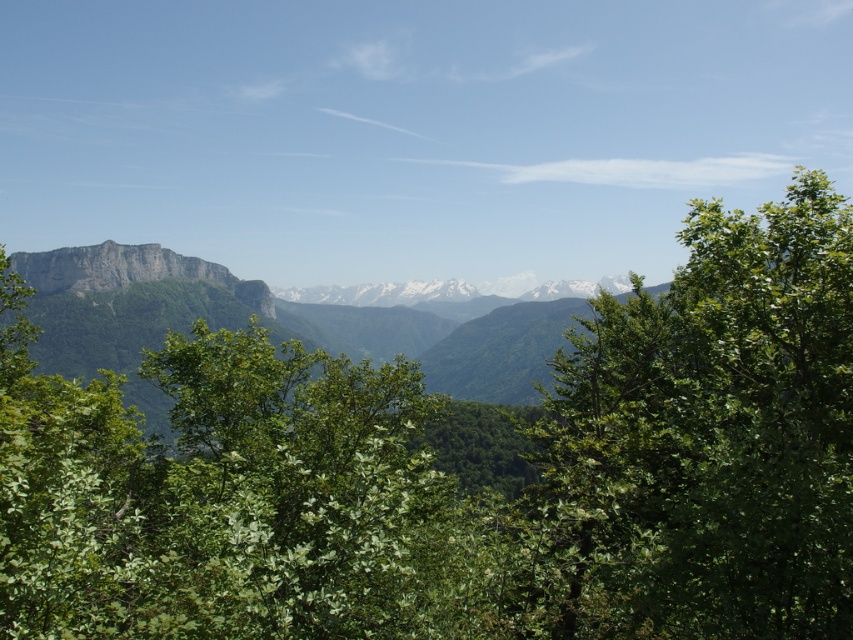
Does green leafy tree at right appear under rocky cliff at center?

Yes.

Who is positioned more to the left, green leafy tree at right or rocky cliff at center?

From the viewer's perspective, rocky cliff at center appears more on the left side.

I want to click on green leafy tree at right, so click(x=708, y=436).

Image resolution: width=853 pixels, height=640 pixels. What are the coordinates of `green leafy tree at right` in the screenshot? It's located at (708, 436).

Which is below, green leafy tree at center or green leafy tree at right?

green leafy tree at center is below.

Is green leafy tree at center wider than green leafy tree at right?

Yes.

Is point (416, 540) positioned before point (697, 554)?

No, (416, 540) is behind (697, 554).

In order to click on green leafy tree at center in this screenshot , I will do `click(451, 484)`.

Between point (30, 512) and point (65, 275), which one is positioned in front?

Point (30, 512) is more forward.

Describe the element at coordinates (451, 484) in the screenshot. The height and width of the screenshot is (640, 853). I see `green leafy tree at center` at that location.

You are a GUI agent. You are given a task and a screenshot of the screen. Output one action in this format:
    pyautogui.click(x=<x>, y=<y>)
    Task: Click on the green leafy tree at center
    
    Given the screenshot: What is the action you would take?
    pyautogui.click(x=451, y=484)

The width and height of the screenshot is (853, 640). Find the location of `green leafy tree at center`. green leafy tree at center is located at coordinates (451, 484).